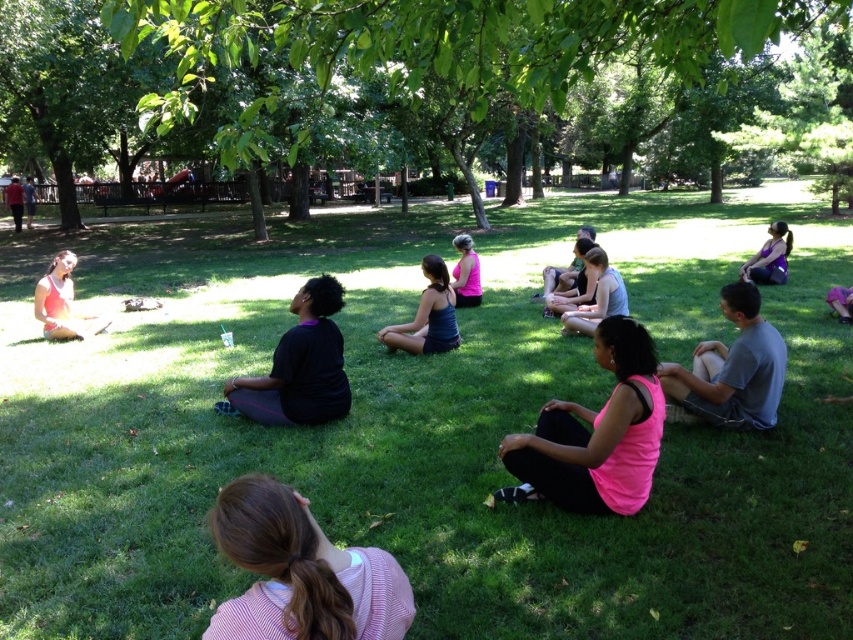
From the picture: Who is more forward, (781, 262) or (473, 291)?

Point (473, 291) is in front.

Is point (759, 253) positioned behind point (463, 305)?

Yes, point (759, 253) is behind point (463, 305).

Who is more distant from viewer, [747,273] or [468,250]?

Point [747,273]

In order to click on purple matte tank top at upper right in this screenshot , I will do `click(769, 257)`.

Measure the distance between gray cotton shirt at lower right and camera.

gray cotton shirt at lower right and camera are 4.89 meters apart from each other.

This screenshot has width=853, height=640. In order to click on gray cotton shirt at lower right in this screenshot , I will do `click(732, 369)`.

Can you confirm if green grass at center is wider than pink fabric ponytail at lower center?

Yes, green grass at center is wider than pink fabric ponytail at lower center.

Is green grass at center to the left of pink fabric ponytail at lower center from the viewer's perspective?

Correct, you'll find green grass at center to the left of pink fabric ponytail at lower center.

Between point (543, 364) and point (294, 516), which one is positioned behind?

The point (543, 364) is behind.

Find the location of `green grass at center`. green grass at center is located at coordinates (421, 426).